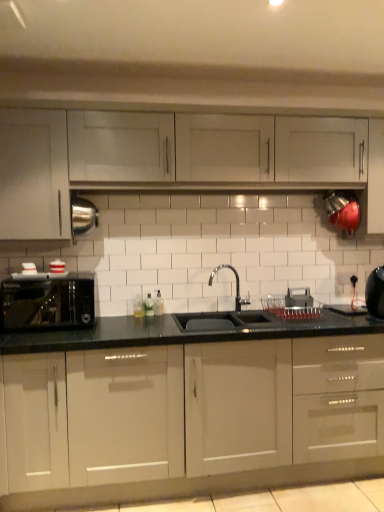
Locate an element on the screen. The image size is (384, 512). vacant space to the right of translucent plastic bottle at center is located at coordinates (177, 314).